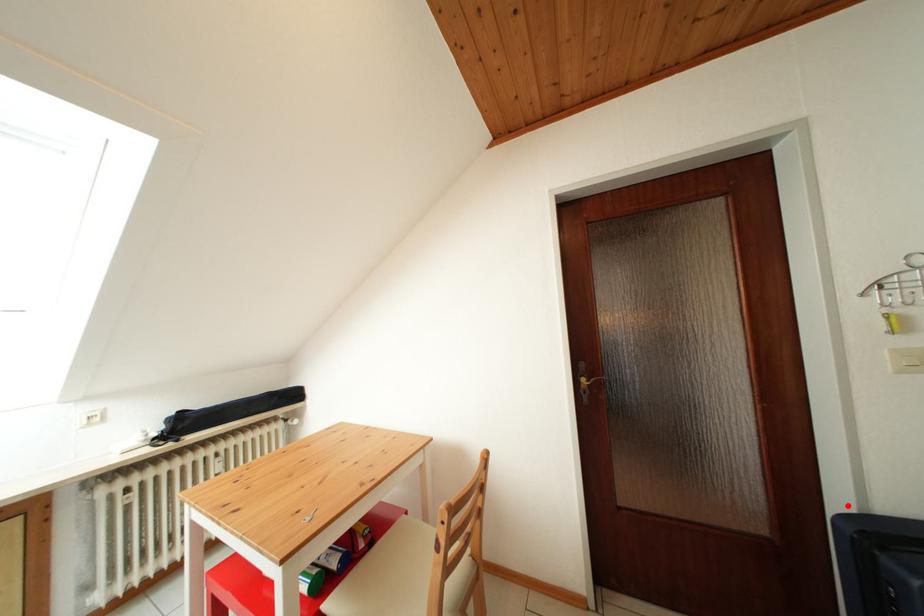
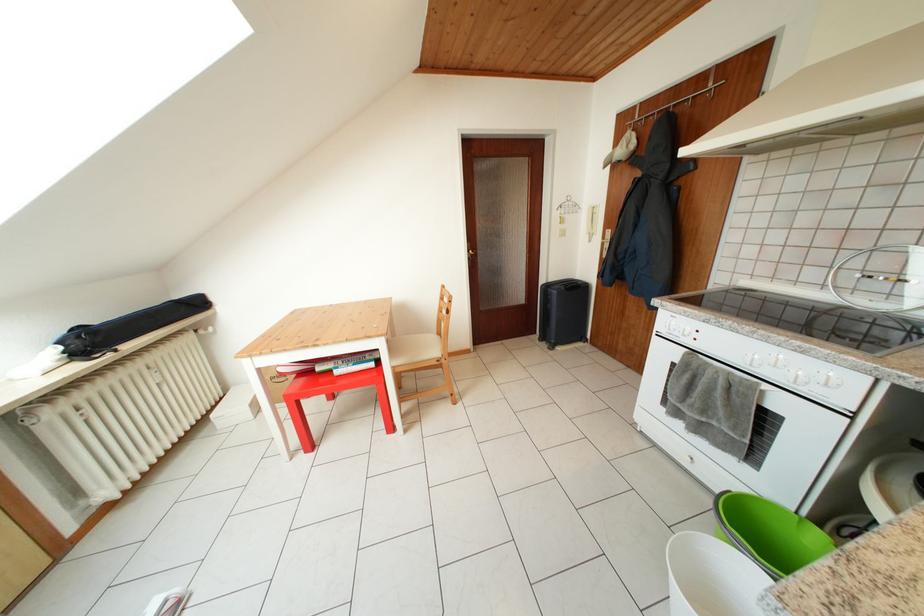
Find the pixel in the second image that matches the highlighted location in the first image.

(551, 286)